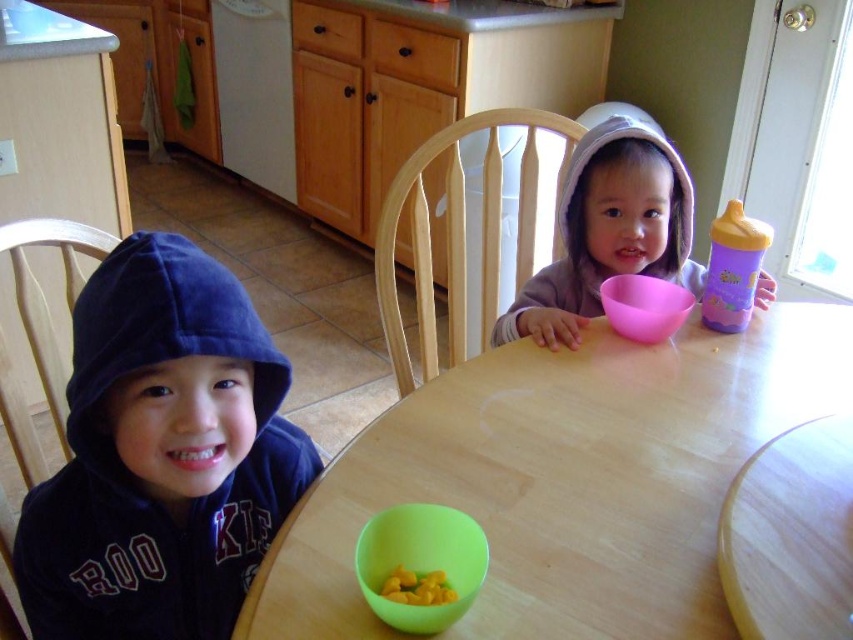
The image size is (853, 640). Describe the element at coordinates (463, 232) in the screenshot. I see `natural wood chair at center` at that location.

Which of these two, natural wood chair at center or wooden chair at left, stands shorter?

wooden chair at left is shorter.

At what (x,y) coordinates should I click in order to perform the action: click on natural wood chair at center. Please return your answer as a coordinate pair (x, y). Looking at the image, I should click on (463, 232).

The height and width of the screenshot is (640, 853). I want to click on natural wood chair at center, so click(x=463, y=232).

Does pink plastic bowl at center have a larger size compared to pink matte bowl at center?

Yes, pink plastic bowl at center is bigger than pink matte bowl at center.

Is point (570, 221) closer to viewer compared to point (666, 296)?

No, it is not.

Locate an element on the screen. Image resolution: width=853 pixels, height=640 pixels. pink plastic bowl at center is located at coordinates (608, 230).

Based on the photo, is green plastic bowl at lower center taller than pink matte bowl at center?

In fact, green plastic bowl at lower center may be shorter than pink matte bowl at center.

Is point (422, 570) in front of point (669, 316)?

Yes, it is.

At what (x,y) coordinates should I click in order to perform the action: click on green plastic bowl at lower center. Please return your answer as a coordinate pair (x, y). This screenshot has height=640, width=853. Looking at the image, I should click on (421, 561).